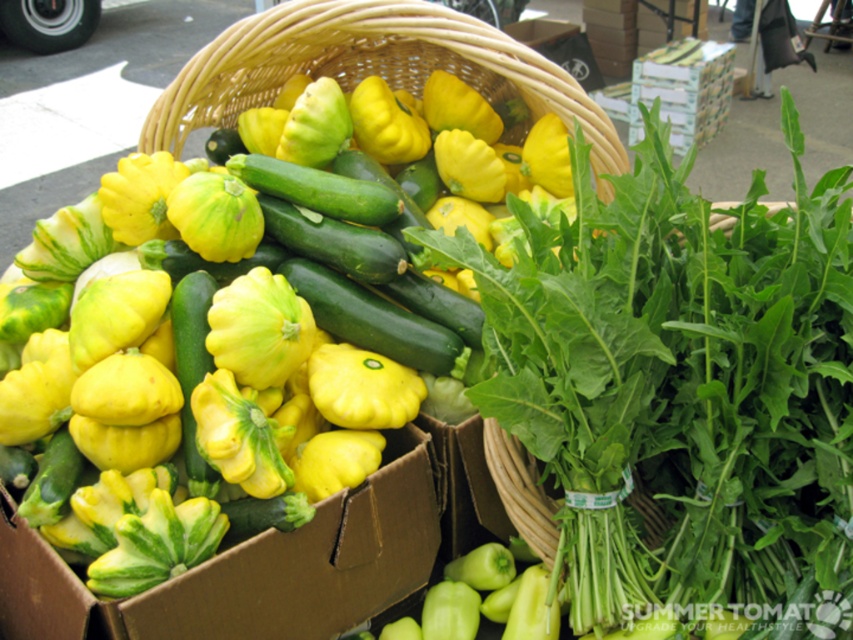
Is green smooth zucchini at center to the left of green matte cucumber at center from the viewer's perspective?

In fact, green smooth zucchini at center is to the right of green matte cucumber at center.

Between green smooth zucchini at center and green matte cucumber at center, which one is positioned higher?

Positioned higher is green smooth zucchini at center.

I want to click on green smooth zucchini at center, so click(x=318, y=189).